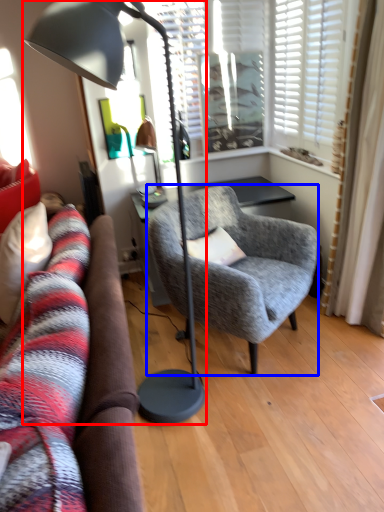
Question: Which object appears closest to the camera in this image, lamp (highlighted by a red box) or chair (highlighted by a blue box)?

Choices:
 (A) lamp
 (B) chair

Answer: (A)